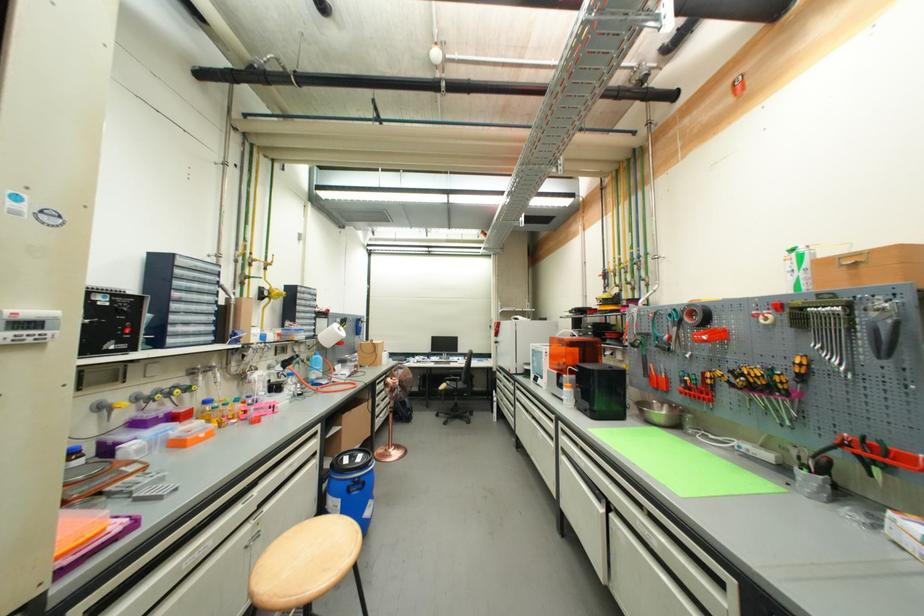
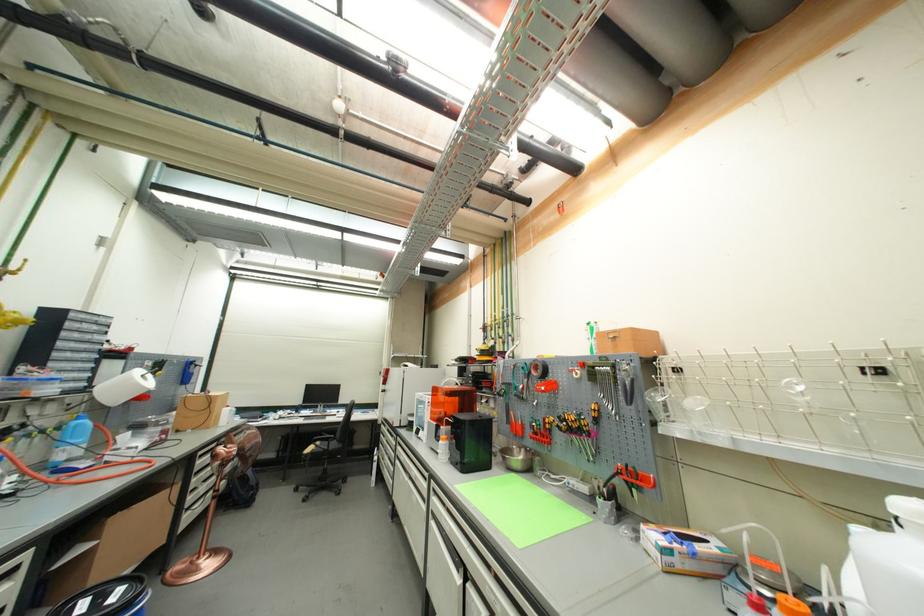
Locate, in the second image, the point that corresponds to [347,460] in the first image.

(80, 606)